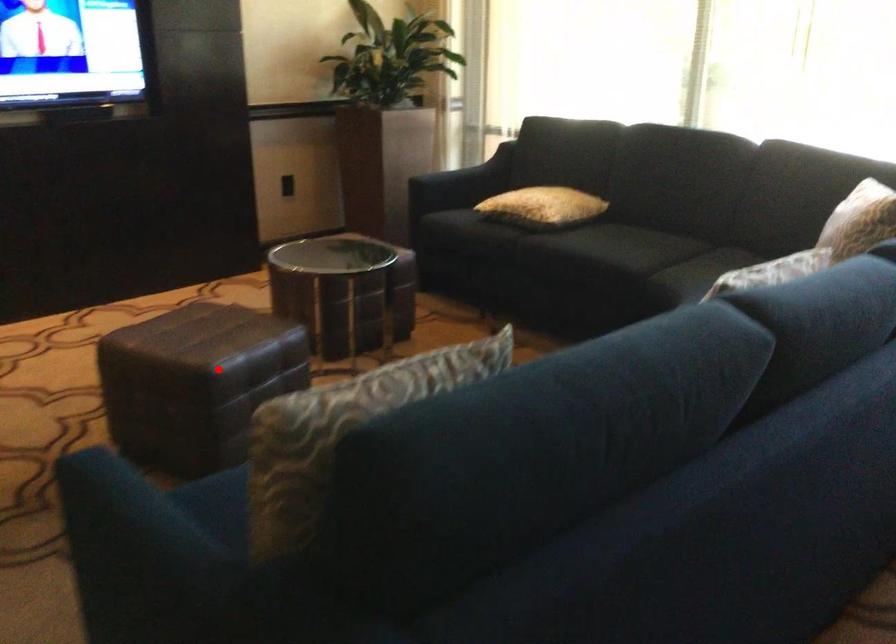
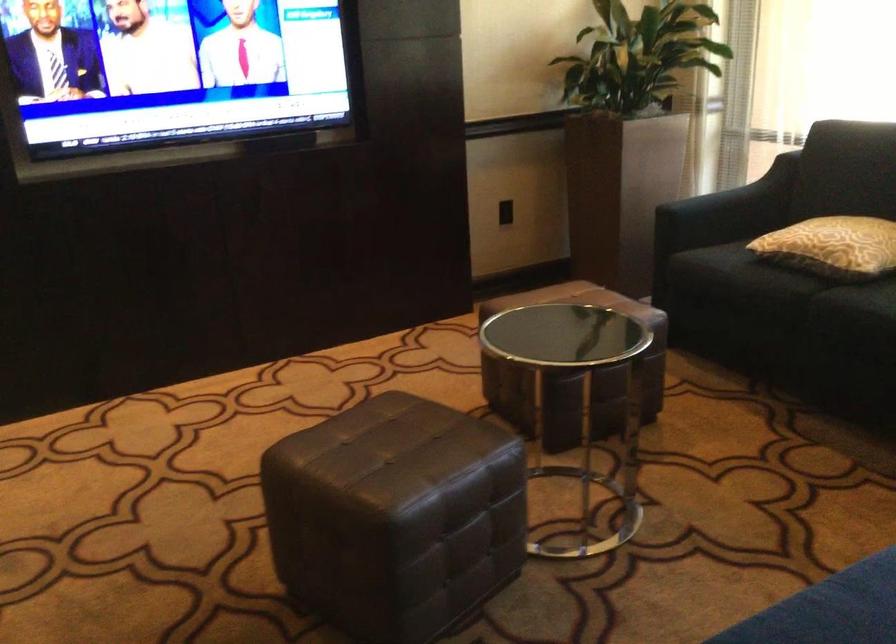
Question: I am providing you with two images of the same scene from different viewpoints. Given a red point in image1, look at the same physical point in image2. Is it:

Choices:
 (A) Closer to the viewpoint
 (B) Farther from the viewpoint

Answer: (A)